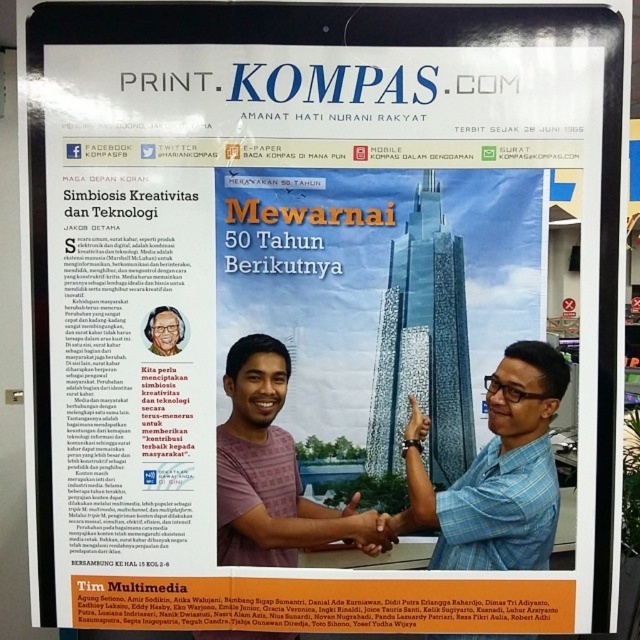
Question: Which is farther from the matte blue hand at center?

Choices:
 (A) purple cotton shirt at center
 (B) blue checkered shirt at center

Answer: (B)

Question: Among these points, which one is nearest to the camera?

Choices:
 (A) (413, 408)
 (B) (492, 424)

Answer: (B)

Question: Which object appears closest to the camera in this image?

Choices:
 (A) matte blue hand at center
 (B) purple cotton shirt at center
 (C) black leather bracelet at center
 (D) matte black glasses at upper left

Answer: (D)

Question: Does purple cotton shirt at center appear on the left side of matte blue hand at center?

Choices:
 (A) no
 (B) yes

Answer: (B)

Question: Does blue checkered shirt at center appear under matte blue hand at center?

Choices:
 (A) no
 (B) yes

Answer: (A)

Question: Is blue checkered shirt at center bigger than matte blue hand at center?

Choices:
 (A) no
 (B) yes

Answer: (B)